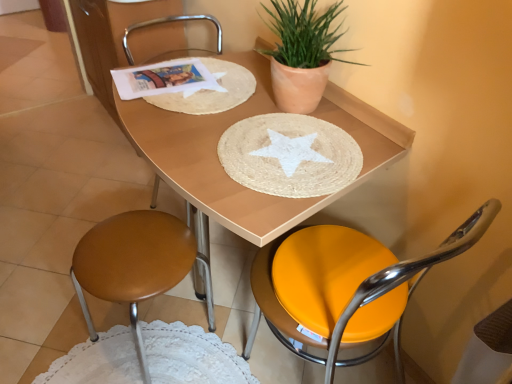
Find the location of `free location to the left of terracotta clay pot at upper right`. free location to the left of terracotta clay pot at upper right is located at coordinates (212, 104).